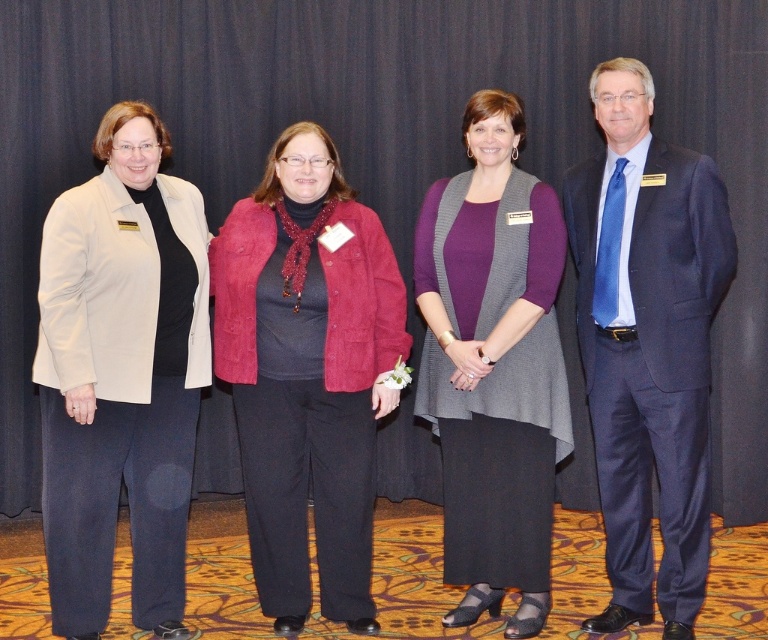
In the scene shown: Who is shorter, beige fabric jacket at left or suede-like red jacket at center?

suede-like red jacket at center

Where is `beige fabric jacket at left`? The width and height of the screenshot is (768, 640). beige fabric jacket at left is located at coordinates (121, 376).

From the picture: Who is shorter, beige fabric jacket at left or navy blue suit at right?

Standing shorter between the two is beige fabric jacket at left.

Is beige fabric jacket at left below navy blue suit at right?

Yes.

Measure the distance between point (131, 420) and camera.

3.37 meters

Where is `beige fabric jacket at left`? The image size is (768, 640). beige fabric jacket at left is located at coordinates (121, 376).

Who is more forward, (224, 262) or (548, 227)?

Point (548, 227)

Who is taller, suede-like red jacket at center or knit gray vest at center?

With more height is knit gray vest at center.

From the picture: Who is more forward, (310, 417) or (419, 234)?

Point (310, 417) is more forward.

The image size is (768, 640). I want to click on suede-like red jacket at center, so click(306, 372).